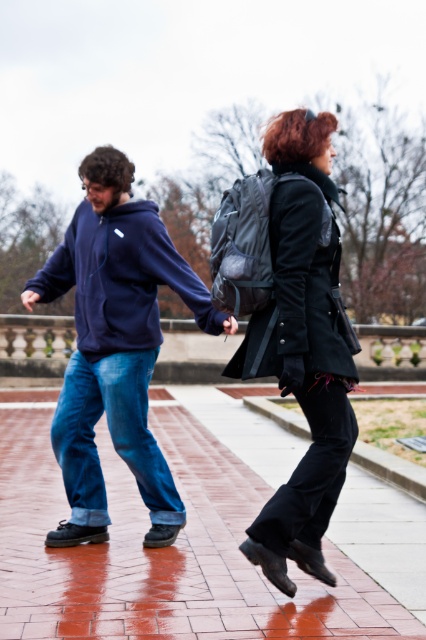
How much distance is there between matte blue hoodie at center and black matte jacket at upper right?

3.47 feet

Does matte blue hoodie at center appear under black matte jacket at upper right?

Indeed, matte blue hoodie at center is positioned under black matte jacket at upper right.

What do you see at coordinates (115, 346) in the screenshot? The height and width of the screenshot is (640, 426). I see `matte blue hoodie at center` at bounding box center [115, 346].

I want to click on matte blue hoodie at center, so click(115, 346).

Measure the distance from brick pavement at center to black matte jacket at upper right.

8.38 feet

Who is higher up, brick pavement at center or black matte jacket at upper right?

black matte jacket at upper right is higher up.

Describe the element at coordinates (161, 550) in the screenshot. The height and width of the screenshot is (640, 426). I see `brick pavement at center` at that location.

The width and height of the screenshot is (426, 640). Find the location of `brick pavement at center`. brick pavement at center is located at coordinates (161, 550).

Looking at this image, is brick pavement at center closer to the viewer compared to matte black coat at center?

No, it is behind matte black coat at center.

Who is positioned more to the left, brick pavement at center or matte black coat at center?

Positioned to the left is brick pavement at center.

Is point (357, 568) closer to viewer compared to point (336, 356)?

That is False.

Locate an element on the screen. brick pavement at center is located at coordinates (161, 550).